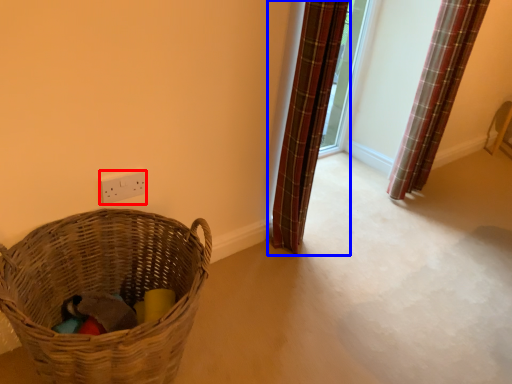
Question: Which object is closer to the camera taking this photo, electric outlet (highlighted by a red box) or curtain (highlighted by a blue box)?

Choices:
 (A) electric outlet
 (B) curtain

Answer: (B)